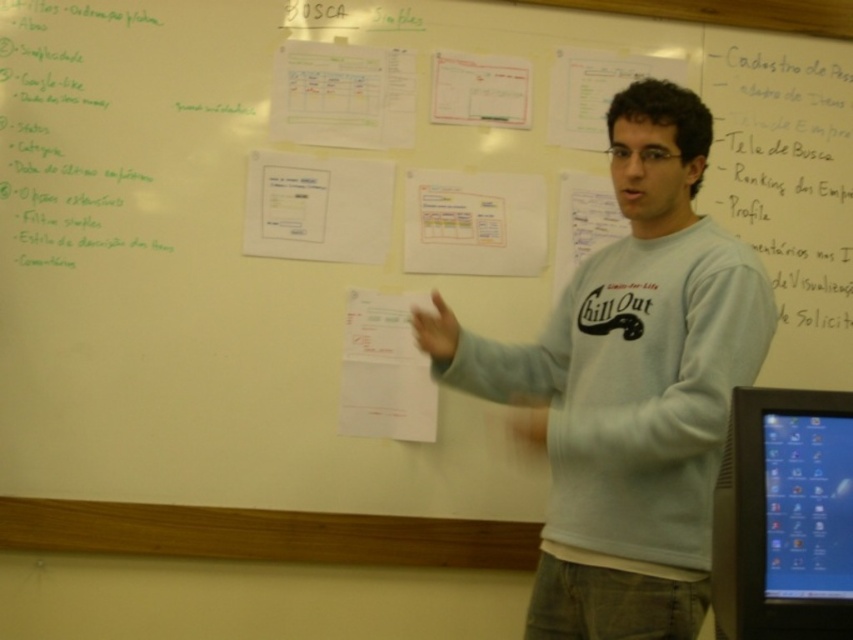
You are in a classroom setting and need to locate the white cotton shirt at center and the blue glossy monitor at right. According to the scene, which object is positioned to the left of the other?

The white cotton shirt at center is to the left of the blue glossy monitor at right.

You are an assistant in a meeting room. You need to determine if the white cotton shirt at center will block the view of the blue glossy monitor at right when standing directly in front of them. Can you confirm?

The white cotton shirt at center has a greater height compared to the blue glossy monitor at right, so it will block the view of the blue glossy monitor at right.

You are a presenter standing 2 meters away from the whiteboard. You want to reach the white cotton shirt at center to adjust it. Can you do so without moving closer?

The white cotton shirt at center is only 1.33 meters away from the viewer, so yes, you can reach it without moving closer since it is closer than 2 meters.